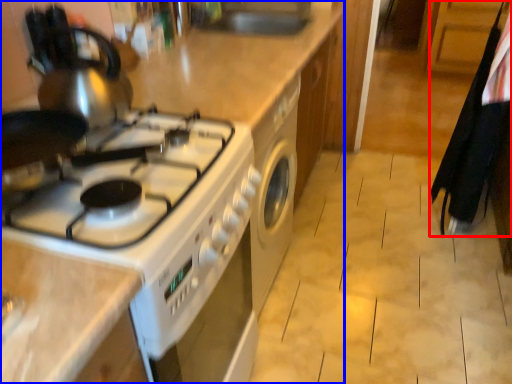
Question: Which object is further to the camera taking this photo, laundry (highlighted by a red box) or kitchen appliance (highlighted by a blue box)?

Choices:
 (A) laundry
 (B) kitchen appliance

Answer: (A)